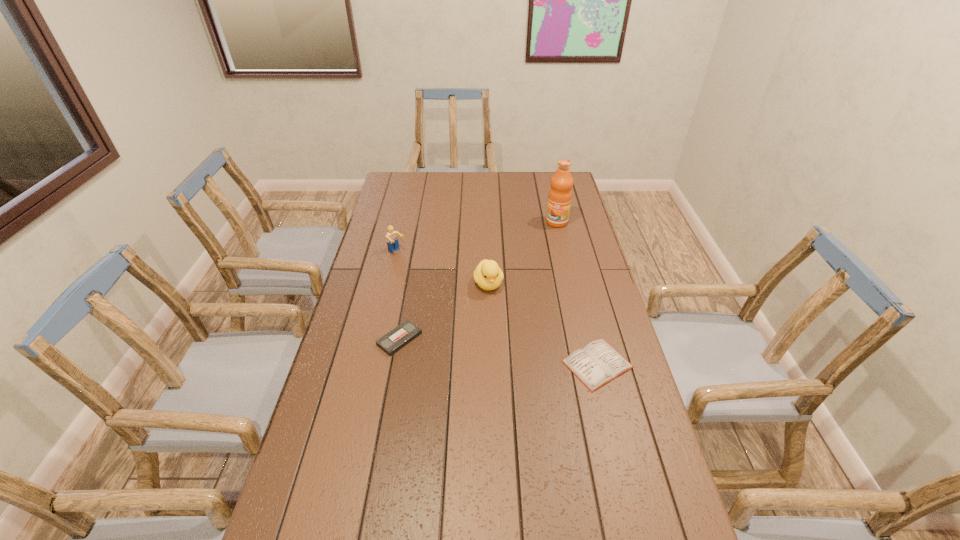
At what (x,y) coordinates should I click in order to perform the action: click on free spot on the desktop that is between the videotape and the diary and is positioned on the front-facing side of the third object from left to right. Please return your answer as a coordinate pair (x, y). The image size is (960, 540). Looking at the image, I should click on (516, 354).

Where is `free space on the desktop that is between the videotape and the diary and is positioned on the face of the fourth nearest object`? The image size is (960, 540). free space on the desktop that is between the videotape and the diary and is positioned on the face of the fourth nearest object is located at coordinates (520, 354).

The image size is (960, 540). I want to click on free spot on the desktop that is between the videotape and the diary and is positioned on the label side of the fruit juice, so click(x=481, y=349).